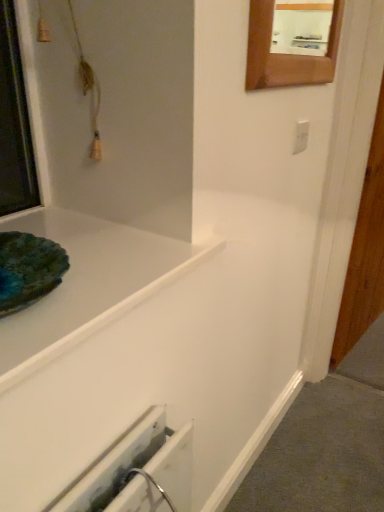
Question: Would you say white plastic electric outlet at upper right is to the left or to the right of wooden frame mirror at upper right in the picture?

Choices:
 (A) right
 (B) left

Answer: (A)

Question: Looking at their shapes, would you say white plastic electric outlet at upper right is wider or thinner than wooden frame mirror at upper right?

Choices:
 (A) thin
 (B) wide

Answer: (A)

Question: Considering the real-world distances, which object is closest to the white glossy bathtub at upper left?

Choices:
 (A) wooden frame mirror at upper right
 (B) white plastic electric outlet at upper right

Answer: (A)

Question: Considering the real-world distances, which object is farthest from the wooden frame mirror at upper right?

Choices:
 (A) white glossy bathtub at upper left
 (B) white plastic electric outlet at upper right

Answer: (A)